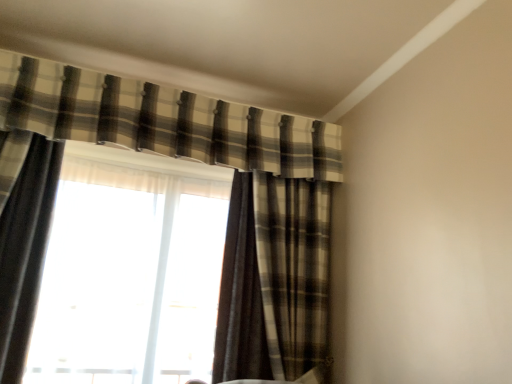
Question: Should I look upward or downward to see brown plaid curtain at center, acting as the 3th curtain starting from the left?

Choices:
 (A) down
 (B) up

Answer: (A)

Question: Would you say plaid fabric curtain at upper center, marked as the 2th curtain in a left-to-right arrangement, is outside brown plaid curtain at center, acting as the 3th curtain starting from the left?

Choices:
 (A) no
 (B) yes

Answer: (B)

Question: Can you confirm if plaid fabric curtain at upper center, which is counted as the 2th curtain, starting from the right, is positioned to the left of brown plaid curtain at center, acting as the 3th curtain starting from the left?

Choices:
 (A) yes
 (B) no

Answer: (A)

Question: From a real-world perspective, is plaid fabric curtain at upper center, which is counted as the 2th curtain, starting from the right, positioned over brown plaid curtain at center, the 1th curtain when ordered from right to left, based on gravity?

Choices:
 (A) yes
 (B) no

Answer: (A)

Question: Does plaid fabric curtain at upper center, marked as the 2th curtain in a left-to-right arrangement, have a greater height compared to brown plaid curtain at center, acting as the 3th curtain starting from the left?

Choices:
 (A) no
 (B) yes

Answer: (A)

Question: Considering the relative sizes of plaid fabric curtain at upper center, which is counted as the 2th curtain, starting from the right, and brown plaid curtain at center, the 1th curtain when ordered from right to left, in the image provided, is plaid fabric curtain at upper center, which is counted as the 2th curtain, starting from the right, thinner than brown plaid curtain at center, the 1th curtain when ordered from right to left,?

Choices:
 (A) yes
 (B) no

Answer: (A)

Question: Is the depth of plaid fabric curtain at upper center, which is counted as the 2th curtain, starting from the right, greater than that of brown plaid curtain at center, the 1th curtain when ordered from right to left?

Choices:
 (A) no
 (B) yes

Answer: (A)

Question: From the image's perspective, is brown plaid curtain at center, acting as the 3th curtain starting from the left, on plaid fabric curtain at upper center, marked as the 2th curtain in a left-to-right arrangement?

Choices:
 (A) yes
 (B) no

Answer: (B)

Question: Is brown plaid curtain at center, the 1th curtain when ordered from right to left, at the left side of plaid fabric curtain at upper center, which is counted as the 2th curtain, starting from the right?

Choices:
 (A) no
 (B) yes

Answer: (A)

Question: Is brown plaid curtain at center, the 1th curtain when ordered from right to left, outside plaid fabric curtain at upper center, which is counted as the 2th curtain, starting from the right?

Choices:
 (A) yes
 (B) no

Answer: (A)

Question: From the image's perspective, is brown plaid curtain at center, the 1th curtain when ordered from right to left, located beneath plaid fabric curtain at upper center, which is counted as the 2th curtain, starting from the right?

Choices:
 (A) no
 (B) yes

Answer: (B)

Question: Is the surface of brown plaid curtain at center, the 1th curtain when ordered from right to left, in direct contact with plaid fabric curtain at upper center, marked as the 2th curtain in a left-to-right arrangement?

Choices:
 (A) yes
 (B) no

Answer: (B)

Question: Could plaid fabric curtain at upper center, which is counted as the 2th curtain, starting from the right, be considered to be inside brown plaid curtain at center, acting as the 3th curtain starting from the left?

Choices:
 (A) yes
 (B) no

Answer: (B)

Question: Can you confirm if brown plaid curtain at center, acting as the 3th curtain starting from the left, is positioned to the left of plaid fabric curtain at left, the 1th curtain when ordered from left to right?

Choices:
 (A) no
 (B) yes

Answer: (A)